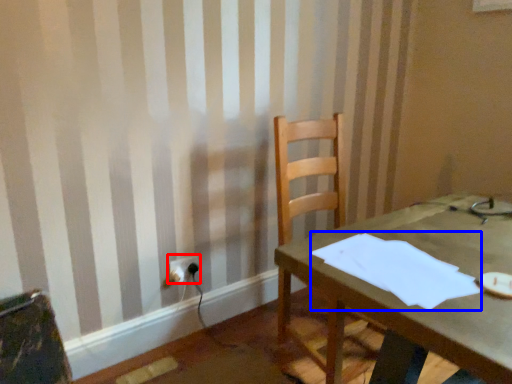
Question: Which point is further to the camera, electric outlet (highlighted by a red box) or paper (highlighted by a blue box)?

Choices:
 (A) electric outlet
 (B) paper

Answer: (A)